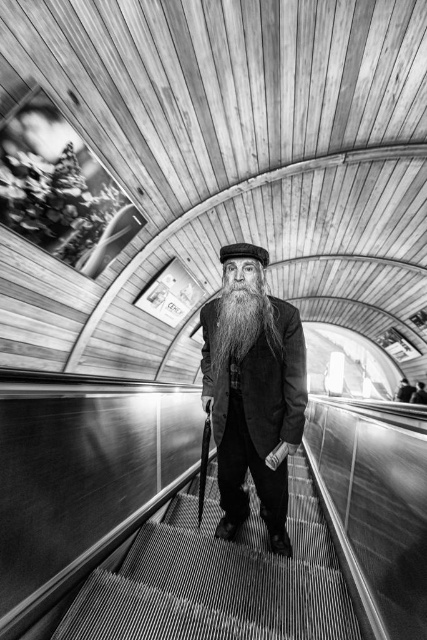
Which is in front, point (225, 561) or point (240, 252)?

Positioned in front is point (240, 252).

Can you confirm if metallic escalator steps at center is positioned to the right of black felt hat at center?

Yes, metallic escalator steps at center is to the right of black felt hat at center.

Is point (222, 577) in front of point (224, 248)?

No, it is not.

Find the location of `metallic escalator steps at center`. metallic escalator steps at center is located at coordinates (219, 580).

Is point (260, 332) closer to camera compared to point (266, 253)?

No, (260, 332) is further to viewer.

Who is more forward, (210, 365) or (234, 253)?

Point (234, 253)

The image size is (427, 640). Identify the location of long white beard at center. (242, 321).

Is metallic escalator steps at center wider than smooth black coat at center?

Correct, the width of metallic escalator steps at center exceeds that of smooth black coat at center.

Who is more distant from viewer, (207, 604) or (254, 440)?

Point (254, 440)

Which is behind, point (125, 621) or point (263, 406)?

Positioned behind is point (263, 406).

Where is `metallic escalator steps at center`? metallic escalator steps at center is located at coordinates (219, 580).